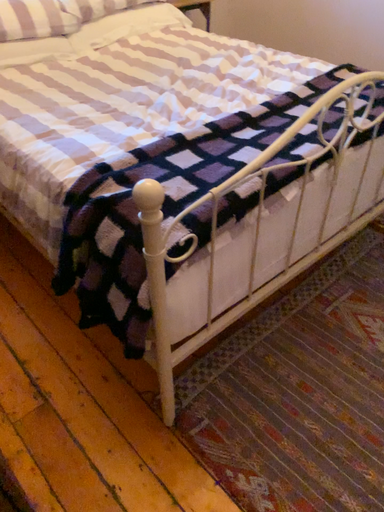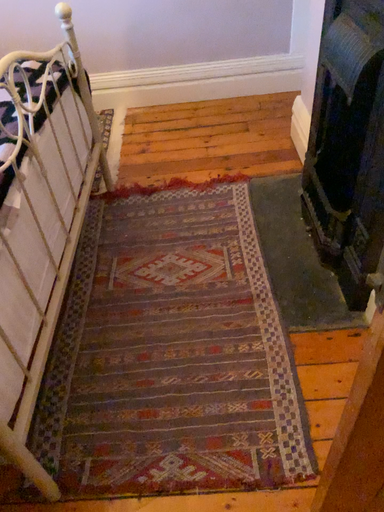
Question: Which way did the camera rotate in the video?

Choices:
 (A) rotated upward
 (B) rotated downward

Answer: (A)